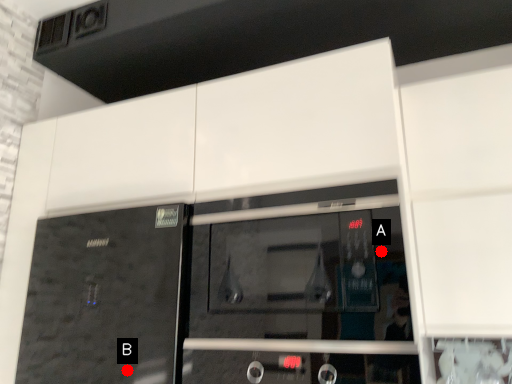
Question: Two points are circled on the image, labeled by A and B beside each circle. Which of the following is the closest to the observer?

Choices:
 (A) A is closer
 (B) B is closer

Answer: (A)